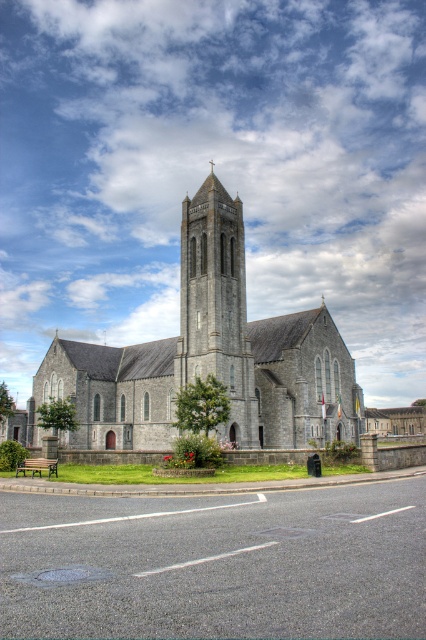
You are standing in front of the gray stone church at center and the smooth stone tower at center. Which one do you think is taller?

The gray stone church at center is much taller than the smooth stone tower at center.

You are standing in front of the grand stone church and want to take a photo. You notice two points marked in the scene. The first point is at coordinates point (333, 417) and the second is at point (209, 340). Which point is closer to your camera when you take the photo?

Point (209, 340) is closer to the camera because it is less further to the camera than point (333, 417), which is further away.

You are planning to take a photo of the gray stone church at center and the smooth stone tower at center from a distance. Which one will appear wider in the photo?

The gray stone church at center will appear wider in the photo because its actual width is larger than the smooth stone tower at center.